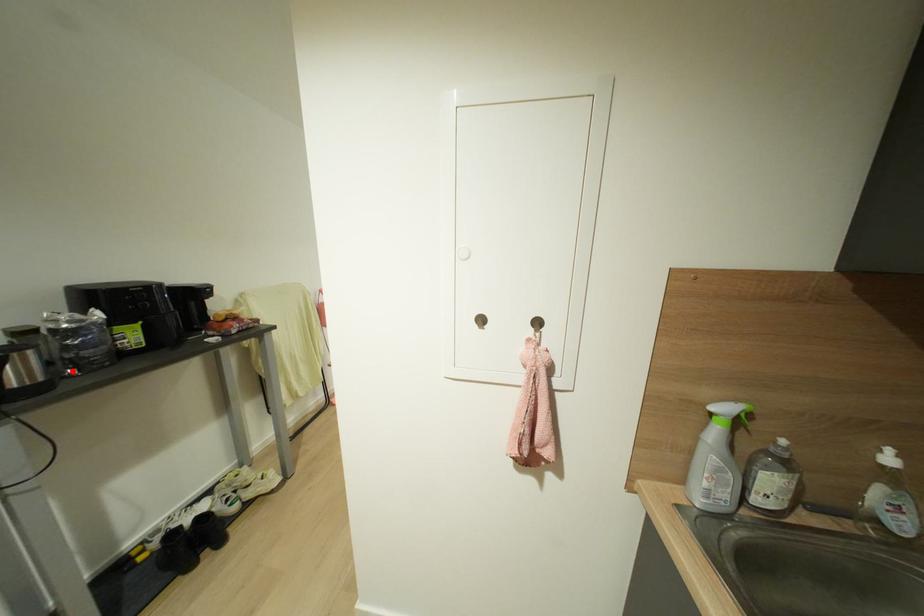
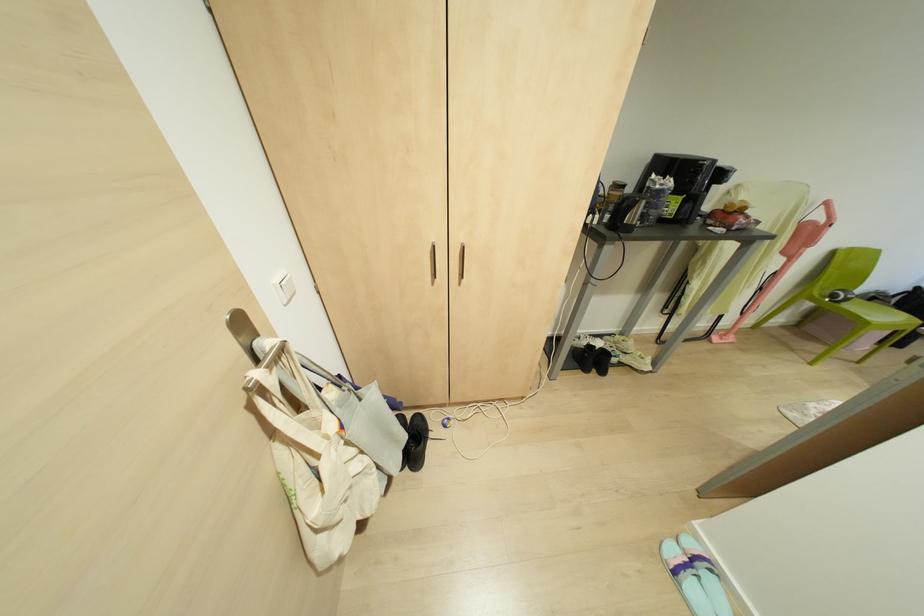
Find the pixel in the second image that matches the highlighted location in the first image.

(637, 223)